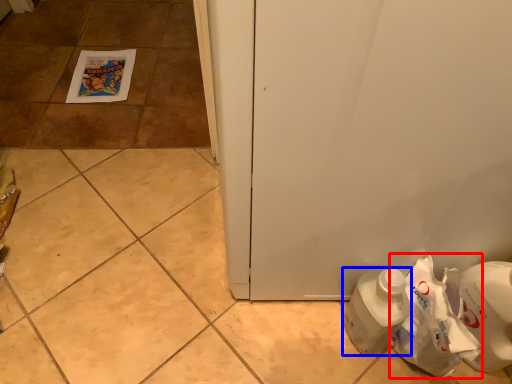
Question: Which point is further to the camera, paper bag (highlighted by a red box) or bottle (highlighted by a blue box)?

Choices:
 (A) paper bag
 (B) bottle

Answer: (B)